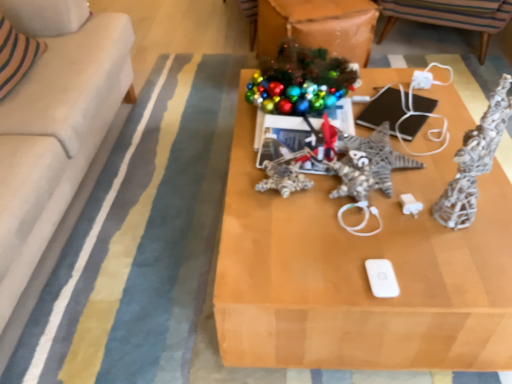
The image size is (512, 384). In order to click on wooden table at center in this screenshot , I will do `click(362, 269)`.

Describe the element at coordinates (382, 278) in the screenshot. I see `white matte ipod at center` at that location.

This screenshot has height=384, width=512. I want to click on wooden table at center, so click(x=362, y=269).

Can you tell me how much striped fabric chair at upper center and white matte ipod at center differ in facing direction?

The angle between the facing direction of striped fabric chair at upper center and the facing direction of white matte ipod at center is 58.4 degrees.

Which of these two, striped fabric chair at upper center or white matte ipod at center, is wider?

Wider between the two is striped fabric chair at upper center.

Locate an element on the screen. ipod located on the left of striped fabric chair at upper center is located at coordinates (382, 278).

Looking at the image, does white fabric couch at left seem bigger or smaller compared to wooden table at center?

Clearly, white fabric couch at left is larger in size than wooden table at center.

From a real-world perspective, is white fabric couch at left on wooden table at center?

Yes, from a real-world perspective, white fabric couch at left is over wooden table at center

Is white fabric couch at left inside the boundaries of wooden table at center, or outside?

white fabric couch at left is outside wooden table at center.

How many degrees apart are the facing directions of white fabric couch at left and wooden table at center?

The angular difference between white fabric couch at left and wooden table at center is 179 degrees.

Considering the sizes of objects striped fabric chair at upper center and wooden table at center in the image provided, who is thinner, striped fabric chair at upper center or wooden table at center?

With smaller width is striped fabric chair at upper center.

Based on the photo, is wooden table at center a part of striped fabric chair at upper center?

No, wooden table at center is not surrounded by striped fabric chair at upper center.

Could you tell me if striped fabric chair at upper center is turned towards wooden table at center?

Yes, striped fabric chair at upper center is facing wooden table at center.

Which is behind, striped fabric chair at upper center or wooden table at center?

Positioned behind is striped fabric chair at upper center.

Can you confirm if white fabric couch at left is bigger than striped fabric chair at upper center?

Yes, white fabric couch at left is bigger than striped fabric chair at upper center.

Which of these two, white fabric couch at left or striped fabric chair at upper center, is thinner?

striped fabric chair at upper center is thinner.

From the image's perspective, relative to striped fabric chair at upper center, is white fabric couch at left above or below?

Clearly, from the image's perspective, white fabric couch at left is below striped fabric chair at upper center.

Are white fabric couch at left and striped fabric chair at upper center far apart?

Yes, white fabric couch at left is far from striped fabric chair at upper center.

From the picture: From the image's perspective, between wooden table at center and white fabric couch at left, which one is located above?

From the image's view, white fabric couch at left is above.

Considering the sizes of objects wooden table at center and white fabric couch at left in the image provided, who is taller, wooden table at center or white fabric couch at left?

Standing taller between the two is white fabric couch at left.

Which object is wider, wooden table at center or white fabric couch at left?

white fabric couch at left.

Is wooden table at center outside of striped fabric chair at upper center?

wooden table at center lies outside striped fabric chair at upper center's area.

Which point is more forward, (351, 324) or (442, 1)?

The point (351, 324) is closer.

Considering the relative sizes of wooden table at center and striped fabric chair at upper center in the image provided, is wooden table at center wider than striped fabric chair at upper center?

Yes.

Can you see wooden table at center touching white matte ipod at center?

wooden table at center and white matte ipod at center are not in contact.

Consider the image. From the image's perspective, which one is positioned higher, wooden table at center or white matte ipod at center?

wooden table at center.

Considering the relative positions of wooden table at center and white matte ipod at center in the image provided, is wooden table at center to the right of white matte ipod at center from the viewer's perspective?

Correct, you'll find wooden table at center to the right of white matte ipod at center.

Is wooden table at center not inside white matte ipod at center?

Yes.

Find the location of a particular element. The image size is (512, 384). ipod below the striped fabric chair at upper center (from the image's perspective) is located at coordinates (382, 278).

The width and height of the screenshot is (512, 384). I want to click on table to the right of white fabric couch at left, so click(362, 269).

Based on their spatial positions, is striped fabric chair at upper center or white matte ipod at center further from white fabric couch at left?

The object further to white fabric couch at left is striped fabric chair at upper center.

Based on their spatial positions, is white matte ipod at center or white fabric couch at left further from striped fabric chair at upper center?

white matte ipod at center lies further to striped fabric chair at upper center than the other object.

Considering their positions, is wooden table at center positioned further to striped fabric chair at upper center than white matte ipod at center?

white matte ipod at center is further to striped fabric chair at upper center.

Based on the photo, when comparing their distances from wooden table at center, does white matte ipod at center or striped fabric chair at upper center seem closer?

white matte ipod at center is positioned closer to the anchor wooden table at center.

When comparing their distances from wooden table at center, does striped fabric chair at upper center or white matte ipod at center seem closer?

Based on the image, white matte ipod at center appears to be nearer to wooden table at center.

From the image, which object appears to be farther from white matte ipod at center, wooden table at center or striped fabric chair at upper center?

striped fabric chair at upper center is positioned further to the anchor white matte ipod at center.

When comparing their distances from white matte ipod at center, does wooden table at center or white fabric couch at left seem closer?

wooden table at center is closer to white matte ipod at center.

Considering their positions, is white matte ipod at center positioned closer to wooden table at center than white fabric couch at left?

white matte ipod at center is closer to wooden table at center.

Identify the location of table between white fabric couch at left and striped fabric chair at upper center. This screenshot has width=512, height=384. (362, 269).

In order to click on ipod between white fabric couch at left and striped fabric chair at upper center in this screenshot , I will do `click(382, 278)`.

The image size is (512, 384). Identify the location of table between striped fabric chair at upper center and white matte ipod at center vertically. 362,269.

Locate an element on the screen. The width and height of the screenshot is (512, 384). ipod between white fabric couch at left and wooden table at center is located at coordinates (382, 278).